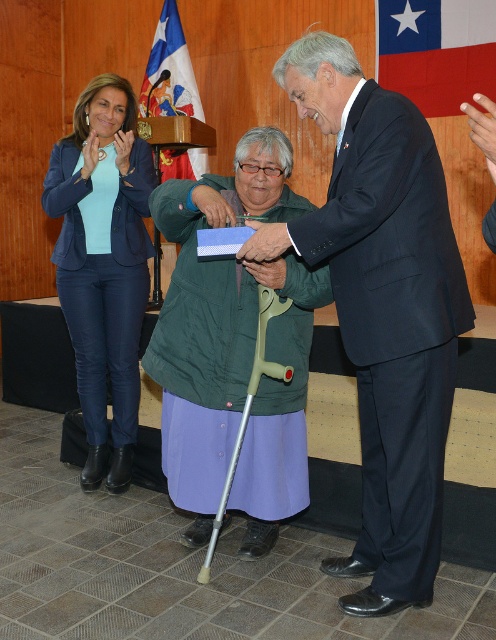
You are organizing a small ceremony and need to place a decorative flag on a table. The table can only hold items smaller than the green fabric crutch at center. Can the red fabric flag at upper right fit on the table?

The green fabric crutch at center is larger in size than the red fabric flag at upper right, so the red fabric flag at upper right can fit on the table since it is smaller than the crutch.

You are standing at point (173, 52) and want to move to point (405, 138). Is the path between these two points clear?

Yes, the path between point (405, 138) and point (173, 52) is clear because point (405, 138) is in front of point (173, 52), indicating no obstruction between them.